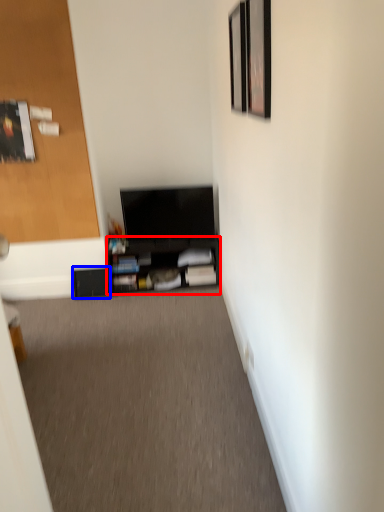
Question: Which of the following is the farthest to the observer, shelf (highlighted by a red box) or shelf (highlighted by a blue box)?

Choices:
 (A) shelf
 (B) shelf

Answer: (B)